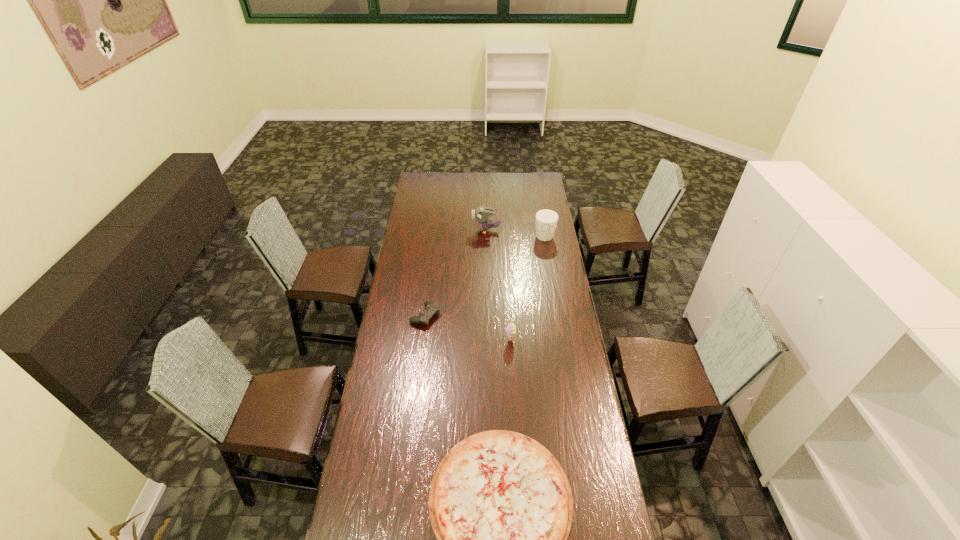
You are a GUI agent. You are given a task and a screenshot of the screen. Output one action in this format:
    pyautogui.click(x=<x>, y=<y>)
    Task: Click on the vacant area between the mug and the fourth tallest object
    
    Given the screenshot: What is the action you would take?
    pyautogui.click(x=485, y=275)

Find the location of a particular element. The image size is (960, 540). free space between the leftmost object and the mug is located at coordinates (485, 275).

This screenshot has height=540, width=960. Find the location of `empty space that is in between the bird and the mug`. empty space that is in between the bird and the mug is located at coordinates (516, 233).

What are the coordinates of `free space between the mug and the bird` in the screenshot? It's located at (516, 233).

Find the location of a particular element. The width and height of the screenshot is (960, 540). object identified as the closest to the mug is located at coordinates (481, 214).

Identify which object is the fourth closest to the fourth farthest object. Please provide its 2D coordinates. Your answer should be formatted as a tuple, i.e. [(x, y)], where the tuple contains the x and y coordinates of a point satisfying the conditions above.

[(481, 214)]

You are a GUI agent. You are given a task and a screenshot of the screen. Output one action in this format:
    pyautogui.click(x=<x>, y=<y>)
    Task: Click on the free space that satisfies the following two spatial constraints: 1. at the beak of the fourth farthest object; 2. on the right side of the bird
    The height and width of the screenshot is (540, 960).
    Given the screenshot: What is the action you would take?
    pyautogui.click(x=488, y=340)

The height and width of the screenshot is (540, 960). Identify the location of vacant space that satisfies the following two spatial constraints: 1. on the front side of the leftmost object; 2. on the right side of the sherbert. (422, 340).

Locate an element on the screen. Image resolution: width=960 pixels, height=540 pixels. free space that satisfies the following two spatial constraints: 1. at the beak of the bird; 2. on the right side of the third tallest object is located at coordinates (488, 340).